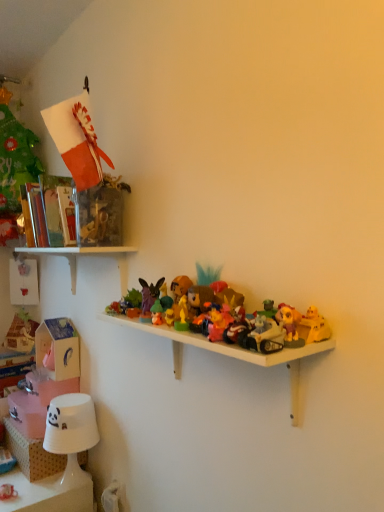
Where is `vacant area situated below white paper lampshade at lower left (from a real-world perspective)`? Image resolution: width=384 pixels, height=512 pixels. vacant area situated below white paper lampshade at lower left (from a real-world perspective) is located at coordinates (69, 482).